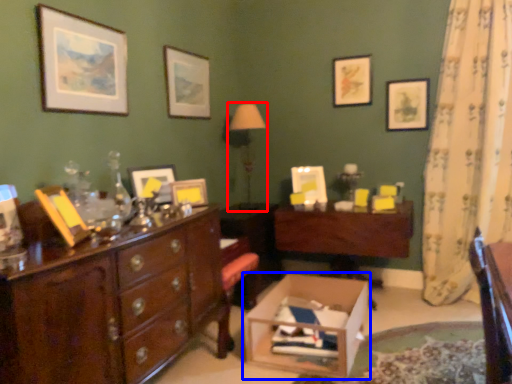
Question: Which object is further to the camera taking this photo, table lamp (highlighted by a red box) or cardboard box (highlighted by a blue box)?

Choices:
 (A) table lamp
 (B) cardboard box

Answer: (A)